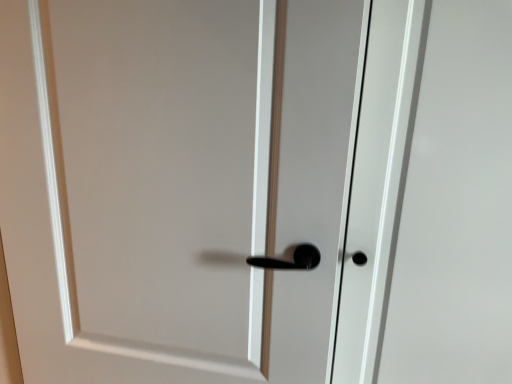
What do you see at coordinates (163, 172) in the screenshot? This screenshot has width=512, height=384. I see `white matte door handle at center` at bounding box center [163, 172].

The image size is (512, 384). Find the location of `white matte door handle at center`. white matte door handle at center is located at coordinates (163, 172).

Measure the distance between point (153,303) and camera.

A distance of 35.16 inches exists between point (153,303) and camera.

Find the location of `white matte door handle at center`. white matte door handle at center is located at coordinates (163, 172).